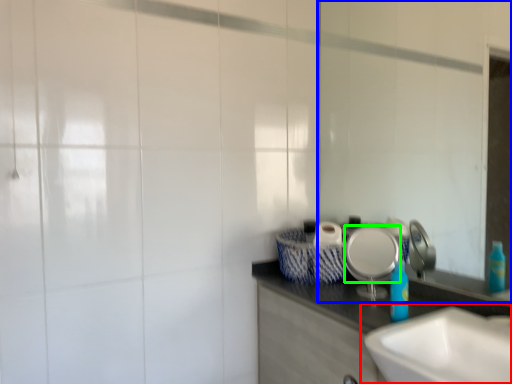
Question: Which is nearer to the sink (highlighted by a red box)? mirror (highlighted by a blue box) or plate (highlighted by a green box).

Choices:
 (A) mirror
 (B) plate

Answer: (B)